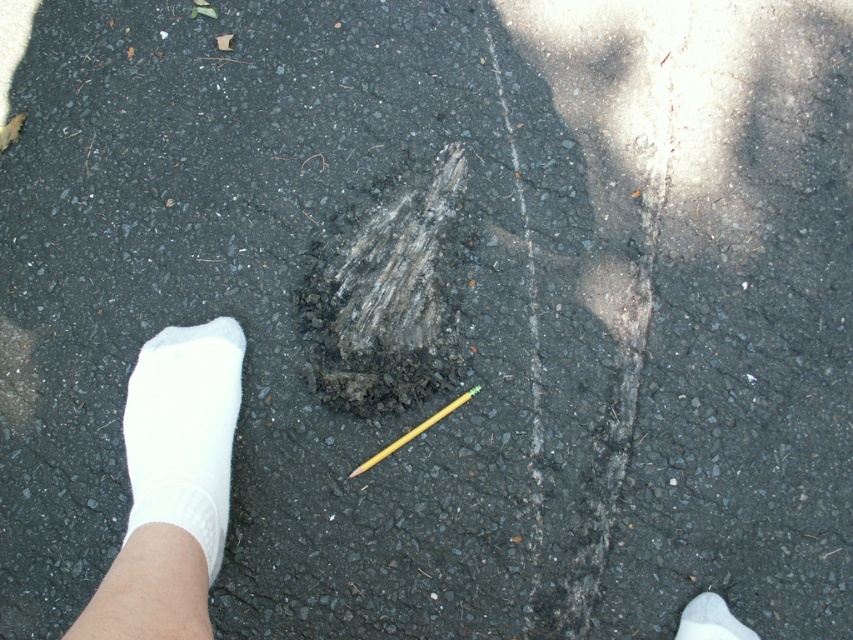
Question: Is white sock at lower left to the left of white sock at lower right from the viewer's perspective?

Choices:
 (A) no
 (B) yes

Answer: (B)

Question: Which object is closer to the camera taking this photo?

Choices:
 (A) dark gray textured footprint at center
 (B) white sock at lower left

Answer: (B)

Question: Can you confirm if white sock at lower left is positioned below yellow wood pencil at center?

Choices:
 (A) no
 (B) yes

Answer: (B)

Question: Which object appears farthest from the camera in this image?

Choices:
 (A) white cotton sock at lower left
 (B) white sock at lower right
 (C) dark gray textured footprint at center
 (D) yellow wood pencil at center

Answer: (C)

Question: Observing the image, what is the correct spatial positioning of white cotton sock at lower left in reference to white sock at lower right?

Choices:
 (A) right
 (B) left

Answer: (B)

Question: Among these points, which one is farthest from the camera?

Choices:
 (A) (422, 429)
 (B) (343, 337)
 (C) (704, 628)
 (D) (170, 326)

Answer: (B)